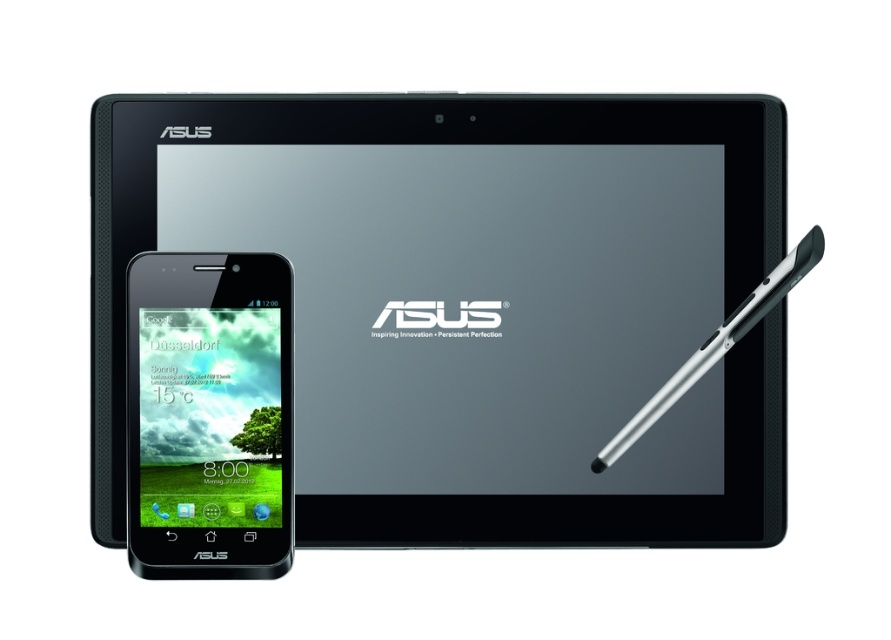
Question: Can you confirm if black matte tablet at upper center is thinner than black matte smartphone at lower left?

Choices:
 (A) yes
 (B) no

Answer: (B)

Question: Is black matte tablet at upper center smaller than silver metallic stylus at right?

Choices:
 (A) yes
 (B) no

Answer: (B)

Question: Which of these objects is positioned closest to the silver metallic stylus at right?

Choices:
 (A) black matte tablet at upper center
 (B) black matte smartphone at lower left

Answer: (A)

Question: Among these objects, which one is nearest to the camera?

Choices:
 (A) silver metallic stylus at right
 (B) black matte smartphone at lower left

Answer: (A)

Question: Observing the image, what is the correct spatial positioning of black matte tablet at upper center in reference to black matte smartphone at lower left?

Choices:
 (A) right
 (B) left

Answer: (A)

Question: Which point is closer to the camera?

Choices:
 (A) (323, 515)
 (B) (683, 381)

Answer: (B)